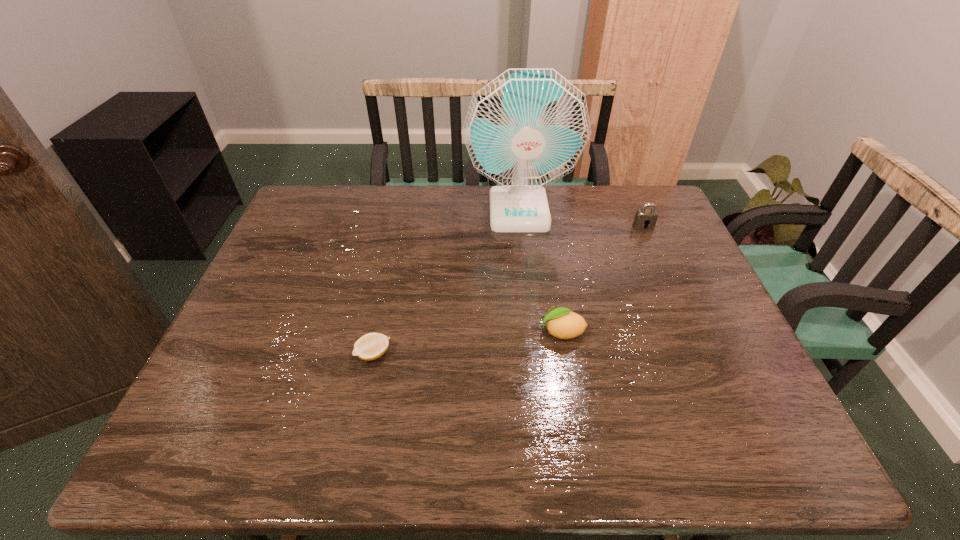
This screenshot has height=540, width=960. Identify the location of vacant space located 0.360m with leaves positioned above the third tallest object. (390, 332).

Where is `free space located 0.250m on the back of the leftmost object`? The height and width of the screenshot is (540, 960). free space located 0.250m on the back of the leftmost object is located at coordinates (392, 271).

This screenshot has height=540, width=960. Find the location of `fan situated at the far edge`. fan situated at the far edge is located at coordinates (527, 128).

In order to click on padlock that is positioned at the far edge in this screenshot , I will do `click(645, 219)`.

Find the location of `object that is at the right edge`. object that is at the right edge is located at coordinates (645, 219).

This screenshot has width=960, height=540. Identify the location of object that is at the far right corner. (645, 219).

You are a GUI agent. You are given a task and a screenshot of the screen. Output one action in this format:
    pyautogui.click(x=<x>, y=<y>)
    Task: Click on the vacant area at the far edge of the desktop
    Image resolution: width=960 pixels, height=540 pixels.
    Given the screenshot: What is the action you would take?
    (415, 186)

The image size is (960, 540). Identify the location of free space at the near edge of the desktop. (372, 425).

I want to click on free space at the left edge of the desktop, so click(x=303, y=238).

This screenshot has height=540, width=960. What are the coordinates of `vacant space at the right edge of the desktop` in the screenshot? It's located at (703, 340).